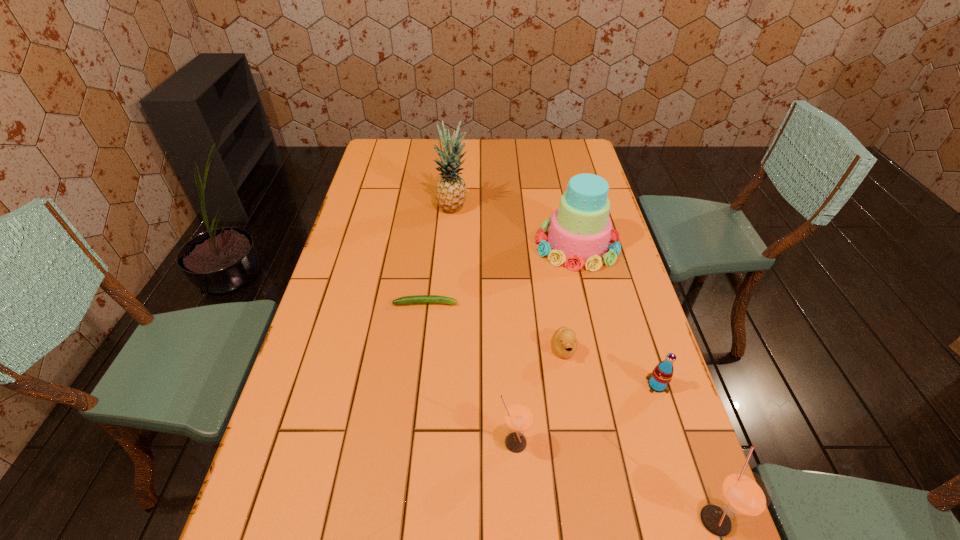
Locate an element on the screen. This screenshot has width=960, height=540. the fourth tallest object is located at coordinates (518, 416).

In order to click on the farther straw in this screenshot , I will do `click(518, 416)`.

This screenshot has height=540, width=960. Find the location of `the sixth nearest object`. the sixth nearest object is located at coordinates (579, 231).

Find the location of `pineapple`. pineapple is located at coordinates (451, 192).

Identify the location of the tallest object. (451, 192).

This screenshot has height=540, width=960. In order to click on duckling in this screenshot , I will do `click(564, 340)`.

Where is `the second shortest object`? This screenshot has width=960, height=540. the second shortest object is located at coordinates (x=564, y=340).

You are a GUI agent. You are given a task and a screenshot of the screen. Output one action in this format:
    pyautogui.click(x=<x>, y=<y>)
    Task: Click on the shortest object
    This screenshot has height=540, width=960.
    Given the screenshot: What is the action you would take?
    (x=417, y=299)

Locate an element on the screen. zucchini is located at coordinates (417, 299).

Find the location of a particular element. The height and width of the screenshot is (540, 960). the third nearest object is located at coordinates (658, 381).